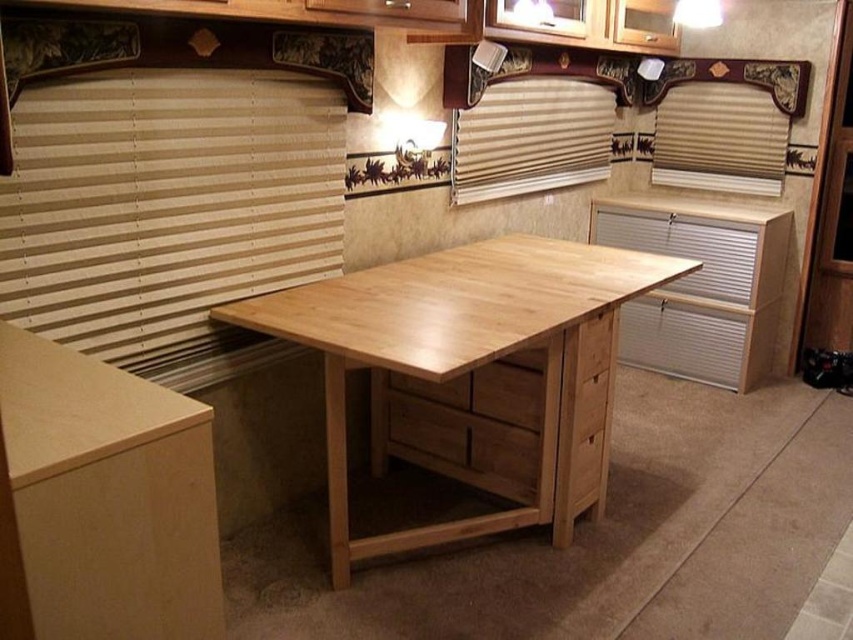
Is beige wood blinds at upper center above beige wood blinds at upper right?

Incorrect, beige wood blinds at upper center is not positioned above beige wood blinds at upper right.

Is beige wood blinds at upper center taller than beige wood blinds at upper right?

Correct, beige wood blinds at upper center is much taller as beige wood blinds at upper right.

The height and width of the screenshot is (640, 853). Describe the element at coordinates (531, 138) in the screenshot. I see `beige wood blinds at upper center` at that location.

Locate an element on the screen. This screenshot has width=853, height=640. beige wood blinds at upper center is located at coordinates (531, 138).

Is wooden blinds at left shorter than beige wood blinds at upper center?

No.

Between wooden blinds at left and beige wood blinds at upper center, which one appears on the right side from the viewer's perspective?

From the viewer's perspective, beige wood blinds at upper center appears more on the right side.

Measure the distance between wooden blinds at left and camera.

wooden blinds at left is 1.66 meters away from camera.

Find the location of a particular element. Image resolution: width=853 pixels, height=640 pixels. wooden blinds at left is located at coordinates (167, 212).

Where is `natural wood table at center`? natural wood table at center is located at coordinates (473, 372).

Which is in front, point (302, 340) or point (526, 173)?

Positioned in front is point (302, 340).

Describe the element at coordinates (473, 372) in the screenshot. This screenshot has width=853, height=640. I see `natural wood table at center` at that location.

The width and height of the screenshot is (853, 640). I want to click on natural wood table at center, so click(473, 372).